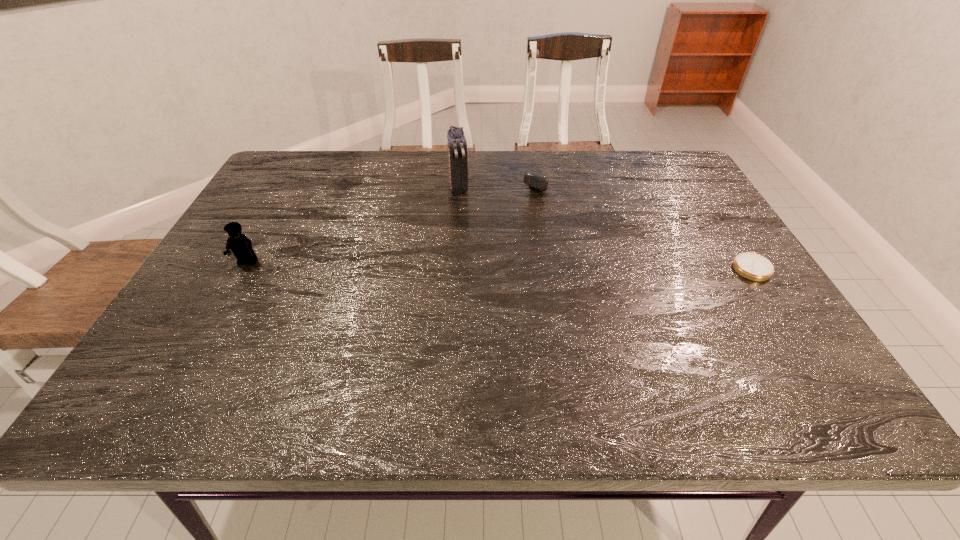
Image resolution: width=960 pixels, height=540 pixels. I want to click on blank space located 0.220m on the front-facing side of the third tallest object, so click(x=498, y=234).

Locate an element on the screen. This screenshot has width=960, height=540. blank area located 0.070m on the front-facing side of the third tallest object is located at coordinates (525, 205).

Identify the location of vacant space located 0.310m on the front-facing side of the third tallest object. The width and height of the screenshot is (960, 540). (480, 253).

The height and width of the screenshot is (540, 960). What are the coordinates of `vacant space situated 0.380m with the zip open on the clutch bag` in the screenshot? It's located at (476, 292).

In order to click on free space located 0.250m with the zip open on the clutch bag in this screenshot , I will do (x=469, y=254).

Locate an element on the screen. The width and height of the screenshot is (960, 540). free space located 0.150m with the zip open on the clutch bag is located at coordinates (466, 229).

Locate an element on the screen. This screenshot has height=540, width=960. webcam at the far edge is located at coordinates (534, 181).

Find the location of a particular element. The width and height of the screenshot is (960, 540). clutch bag that is positioned at the far edge is located at coordinates (458, 172).

Where is `object positioned at the left edge`? object positioned at the left edge is located at coordinates (240, 245).

Identify the location of object present at the right edge. (752, 266).